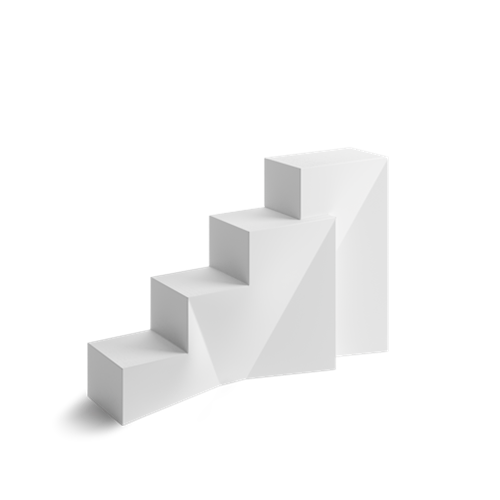
The width and height of the screenshot is (500, 500). Find the location of `step on white staircase`. step on white staircase is located at coordinates (319, 158), (254, 221), (198, 285), (134, 350).